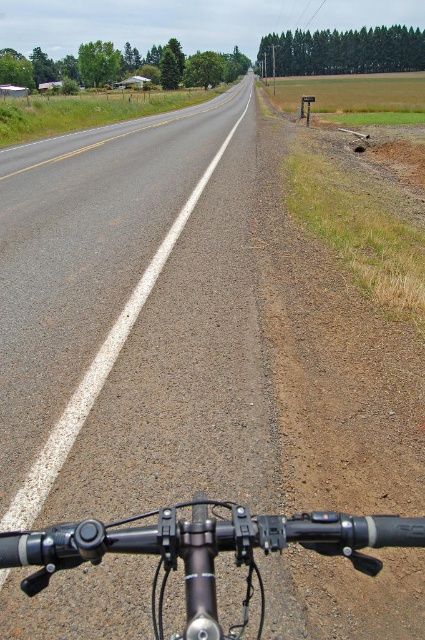
Can you confirm if shiny black handlebars at bottom center is bigger than asphalt road at center?

Incorrect, shiny black handlebars at bottom center is not larger than asphalt road at center.

Describe the element at coordinates (204, 550) in the screenshot. I see `shiny black handlebars at bottom center` at that location.

Is point (189, 541) positioned behind point (25, 480)?

That is False.

I want to click on shiny black handlebars at bottom center, so click(x=204, y=550).